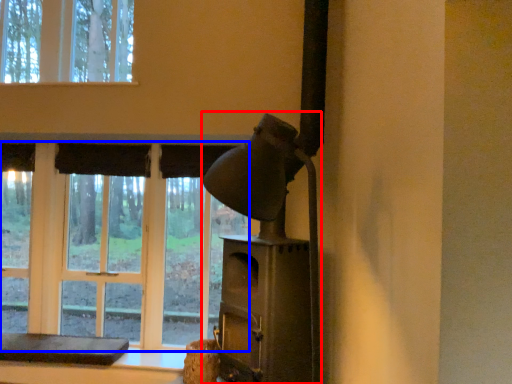
Question: Among these objects, which one is farthest to the camera, fireplace (highlighted by a red box) or bay window (highlighted by a blue box)?

Choices:
 (A) fireplace
 (B) bay window

Answer: (B)